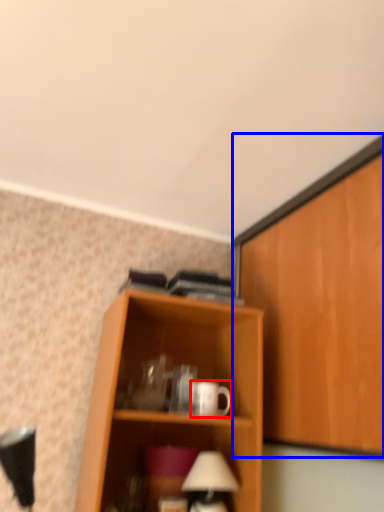
Question: Which point is further to the camera, mug (highlighted by a red box) or cabinetry (highlighted by a blue box)?

Choices:
 (A) mug
 (B) cabinetry

Answer: (A)